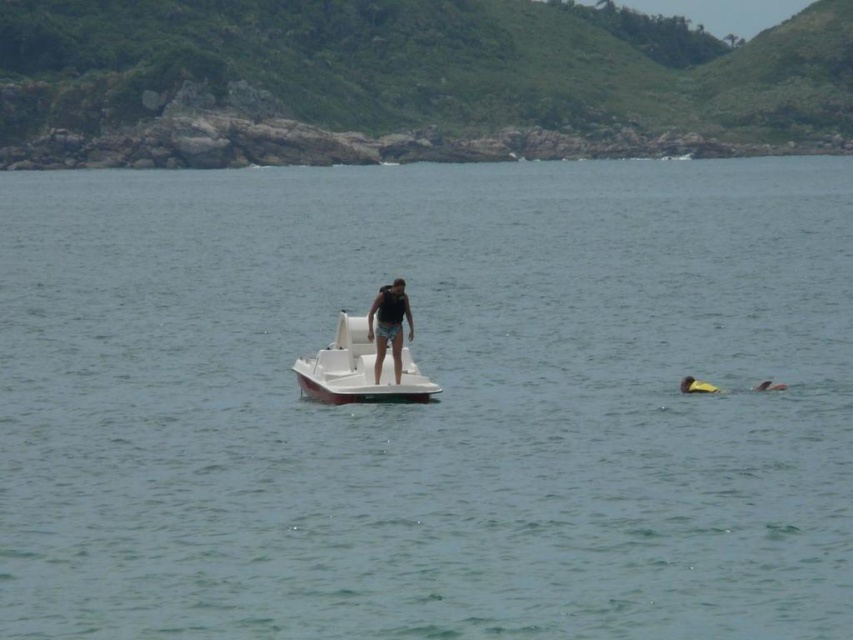
Question: Does white matte boat at center have a smaller size compared to matte black tank top at center?

Choices:
 (A) yes
 (B) no

Answer: (B)

Question: Is the position of white matte boat at center more distant than that of matte black tank top at center?

Choices:
 (A) yes
 (B) no

Answer: (B)

Question: Which point is closer to the camera taking this photo?

Choices:
 (A) (408, 316)
 (B) (314, 397)

Answer: (A)

Question: Can you confirm if white matte boat at center is positioned below matte black tank top at center?

Choices:
 (A) no
 (B) yes

Answer: (B)